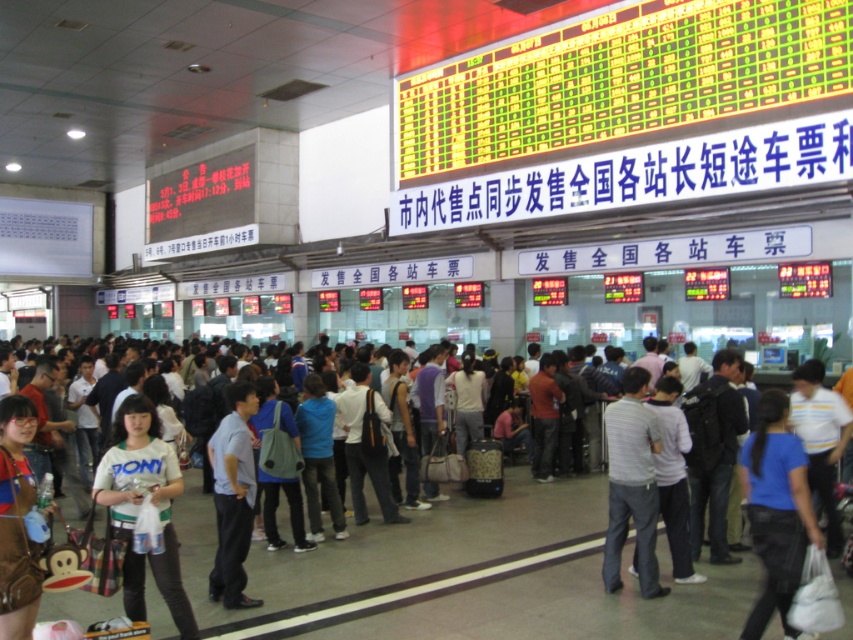
Question: Does blue cotton shirt at center appear on the left side of denim jacket at lower left?

Choices:
 (A) no
 (B) yes

Answer: (A)

Question: Does blue cotton shirt at center appear on the left side of denim jacket at lower left?

Choices:
 (A) yes
 (B) no

Answer: (B)

Question: Which point appears farthest from the camera in this image?

Choices:
 (A) (16, 513)
 (B) (781, 506)

Answer: (B)

Question: Can you confirm if blue cotton shirt at center is bigger than denim jacket at lower left?

Choices:
 (A) yes
 (B) no

Answer: (A)

Question: Which point is farther to the camera?

Choices:
 (A) blue cotton shirt at center
 (B) denim jacket at lower left

Answer: (A)

Question: Which point is farther from the camera taking this photo?

Choices:
 (A) [746, 452]
 (B) [16, 524]

Answer: (A)